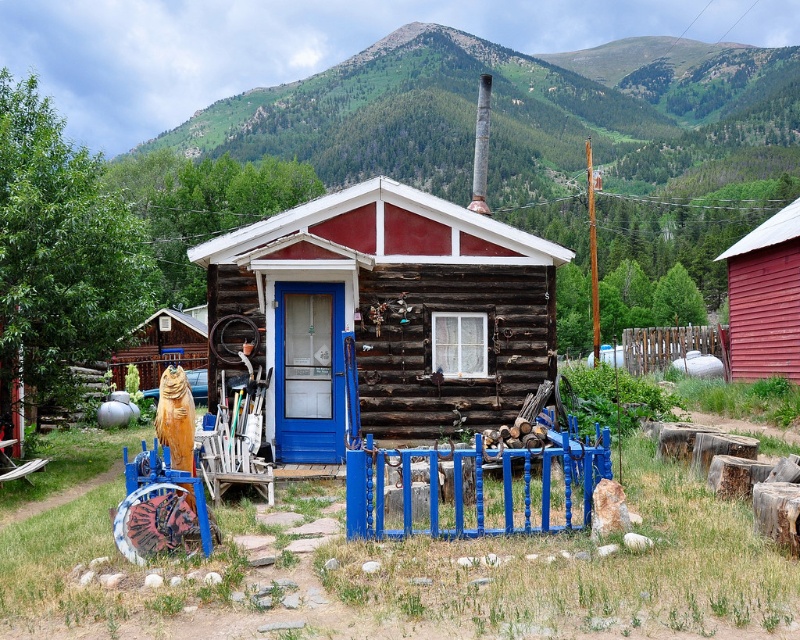
You are standing at a point 87.92 meters away from the cabin. You want to walk straight towards the cabin. Will you pass through the point labeled as point (282, 134)? Please explain your reasoning.

The point (282, 134) is located 87.92 meters away from the viewer. Since you are starting at that exact distance and walking straight towards the cabin, you would be moving away from the point. Therefore, you will not pass through point (282, 134) on your path.

You are standing in front of the cabin and need to determine the relative widths of the green forested mountain at upper center and the red wood cabin at right. Based on the scene, which one is wider?

The green forested mountain at upper center is wider than the red wood cabin at right according to the description.

You are standing in front of the rustic log cabin and notice two points marked on the ground. The first point is at coordinates point (480, 316) and the second is at point (758, 349). Which point is closer to you?

Point (480, 316) is closer to the camera than point (758, 349), so the first point is closer to you.